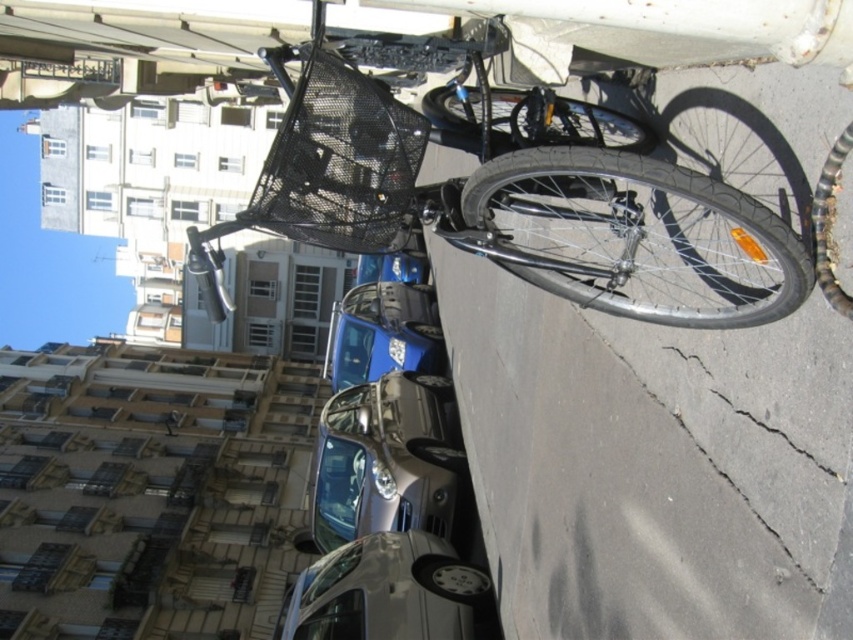
You are a delivery person who needs to load a package onto the shiny black bicycle at center and the shiny silver car at center. Which one requires a taller loading platform?

The shiny black bicycle at center requires a taller loading platform because it is much taller than the shiny silver car at center.

You are a delivery person trying to park your shiny black bicycle at center between two parked cars. The space between the metallic blue car at center and another car is exactly the width of the bicycle. Can your bicycle fit into the space?

The shiny black bicycle at center is larger in size than metallic blue car at center. Since the space between the metallic blue car at center and another car is exactly the width of the bicycle, the bicycle cannot fit into the space because it is wider than the car, making the space insufficient.